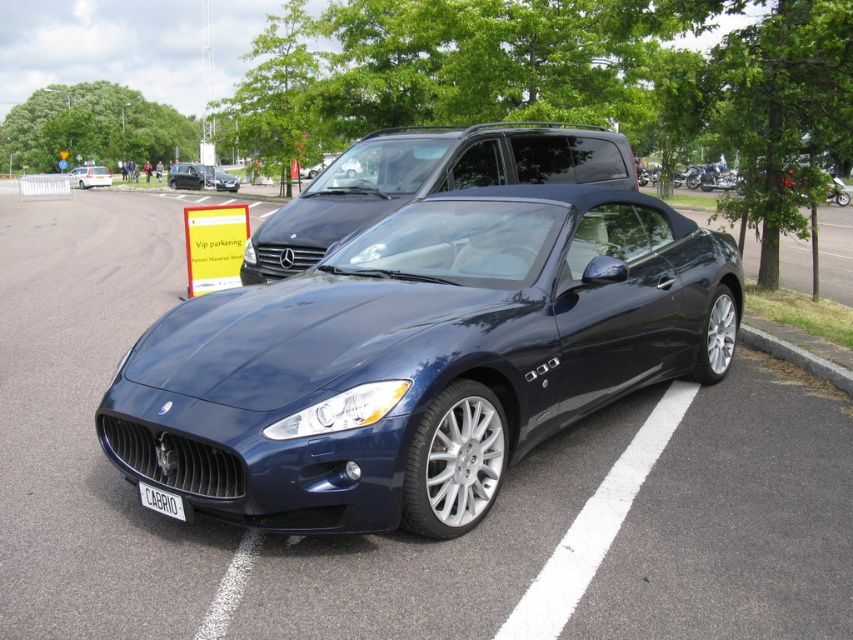
Question: Is glossy black car at center positioned in front of gray concrete curb at lower right?

Choices:
 (A) yes
 (B) no

Answer: (B)

Question: Which point is farther to the camera?

Choices:
 (A) (277, 230)
 (B) (160, 504)

Answer: (A)

Question: Does glossy metallic car at center appear over white plastic license plate at center?

Choices:
 (A) yes
 (B) no

Answer: (A)

Question: Considering the real-world distances, which object is farthest from the silver metallic van at left?

Choices:
 (A) glossy metallic car at center
 (B) white plastic license plate at center

Answer: (B)

Question: Which object appears closest to the camera in this image?

Choices:
 (A) silver metallic van at left
 (B) white plastic license plate at center

Answer: (B)

Question: Is glossy metallic car at center positioned before matte black car at center?

Choices:
 (A) yes
 (B) no

Answer: (A)